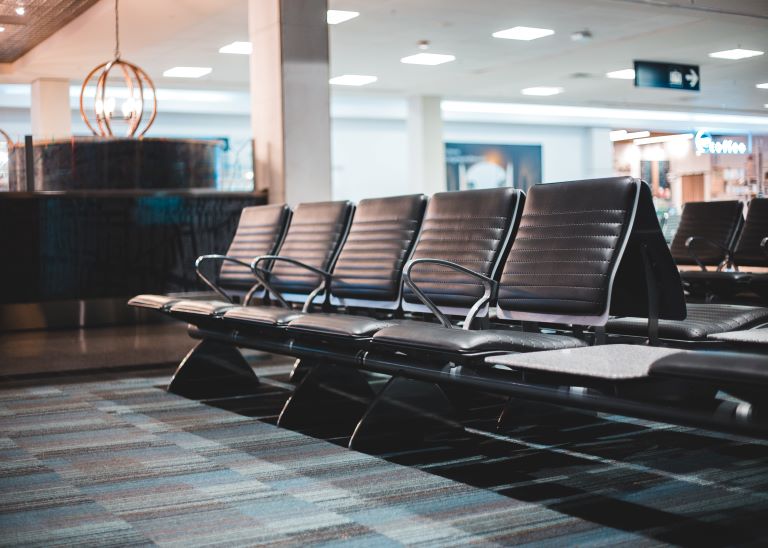
Where is `seat`? This screenshot has width=768, height=548. seat is located at coordinates (502, 336).